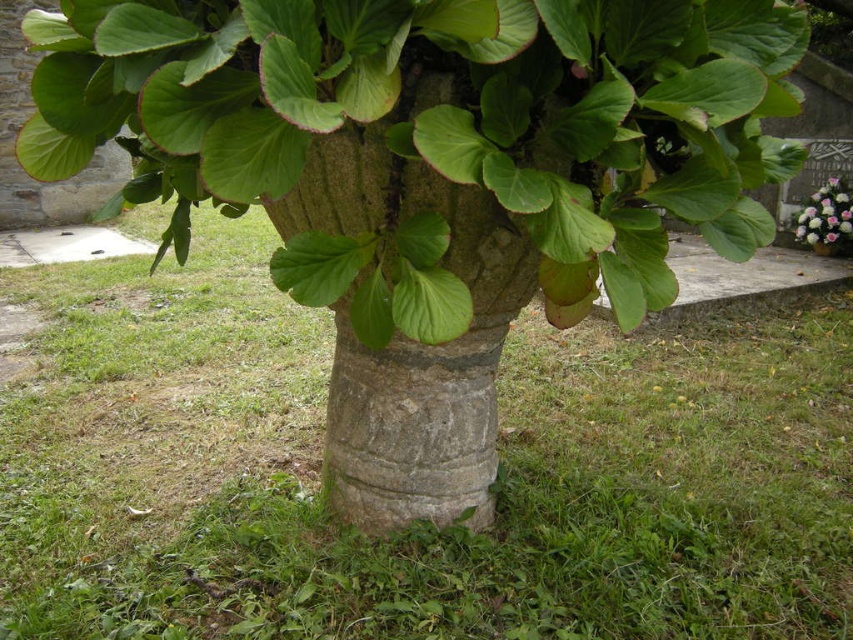
You are a gardener who wants to place a decorative statue that is 1.2 meters tall in the scene. Given the smooth stone tree trunk at center and the pink floral bouquet at upper right, which object can the statue be placed next to without blocking the view of the other object?

The smooth stone tree trunk at center has a larger size compared to the pink floral bouquet at upper right. Since the statue is 1.2 meters tall, placing it next to the pink floral bouquet at upper right would prevent it from blocking the view of the larger tree trunk.

You are a gardener who wants to place a new small statue exactly halfway between the smooth stone tree trunk at center and the pink floral bouquet at upper right. Based on their heights, will the statue be closer to the ground or higher up?

The smooth stone tree trunk at center is much taller than the pink floral bouquet at upper right. Therefore, the halfway point between them would still be closer to the height of the taller tree trunk, meaning the statue will be placed higher up.

In the scene shown: Based on the scene description, is the smooth stone tree trunk at center wider than the pink floral bouquet at upper right?

The smooth stone tree trunk at center might be wider than the pink floral bouquet at upper right according to the description.